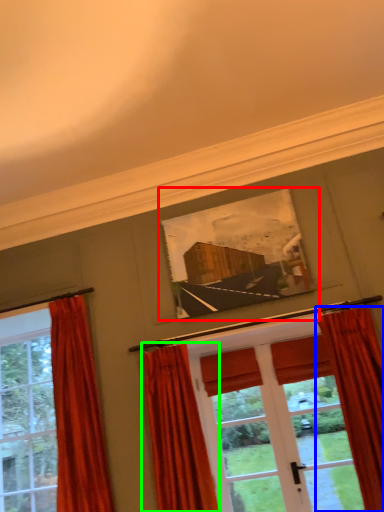
Question: Which object is the farthest from picture frame (highlighted by a red box)? Choose among these: curtain (highlighted by a blue box) or curtain (highlighted by a green box).

Choices:
 (A) curtain
 (B) curtain

Answer: (B)